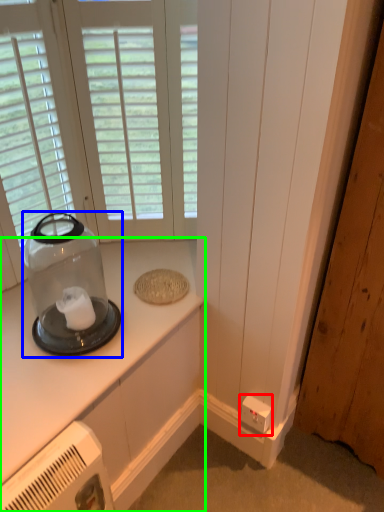
Question: Which is farther away from electric outlet (highlighted by a red box)? appliance (highlighted by a blue box) or countertop (highlighted by a green box)?

Choices:
 (A) appliance
 (B) countertop

Answer: (A)